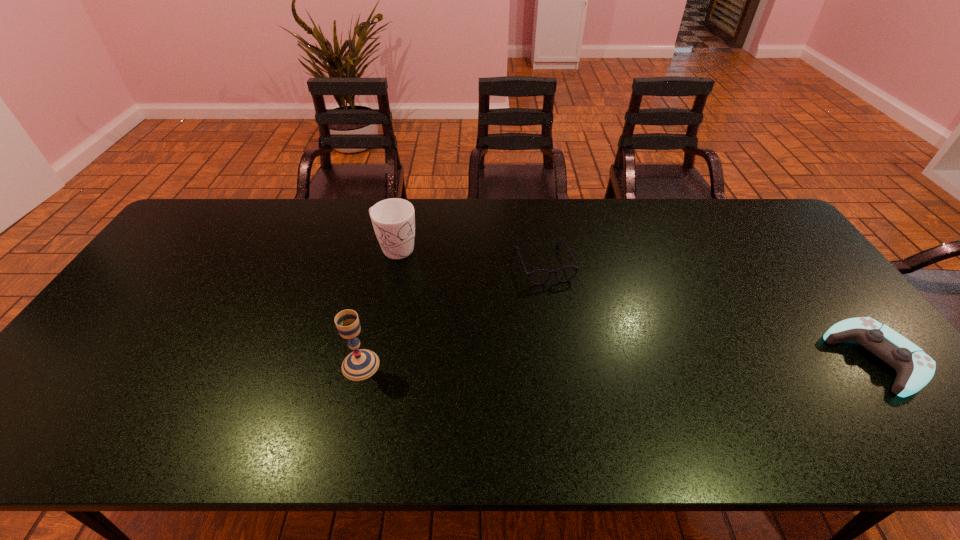
Identify the location of free space at the far right corner. This screenshot has width=960, height=540. (753, 234).

This screenshot has height=540, width=960. In order to click on vacant space that's between the control and the spectacles in this screenshot , I will do `click(710, 312)`.

Where is `free space between the rightmost object and the mug`? Image resolution: width=960 pixels, height=540 pixels. free space between the rightmost object and the mug is located at coordinates (636, 304).

You are a GUI agent. You are given a task and a screenshot of the screen. Output one action in this format:
    pyautogui.click(x=<x>, y=<y>)
    Task: Click on the vacant area that lies between the mug and the second object from right to left
    This screenshot has height=540, width=960.
    Given the screenshot: What is the action you would take?
    pyautogui.click(x=469, y=256)

Identify the location of vacant point located between the spectacles and the rightmost object. This screenshot has width=960, height=540. (710, 312).

The height and width of the screenshot is (540, 960). In order to click on vacant space that's between the third object from left to right and the chalice in this screenshot , I will do `click(452, 314)`.

Locate an element on the screen. free point between the second object from right to left and the chalice is located at coordinates (452, 314).

Locate an element on the screen. vacant space in between the mug and the rightmost object is located at coordinates 636,304.

You are a GUI agent. You are given a task and a screenshot of the screen. Output one action in this format:
    pyautogui.click(x=<x>, y=<y>)
    Task: Click on the vacant area between the control and the mug
    This screenshot has height=540, width=960.
    Given the screenshot: What is the action you would take?
    pyautogui.click(x=636, y=304)

Where is `vacant area that lies between the mug and the chalice`? The image size is (960, 540). vacant area that lies between the mug and the chalice is located at coordinates pyautogui.click(x=378, y=307).